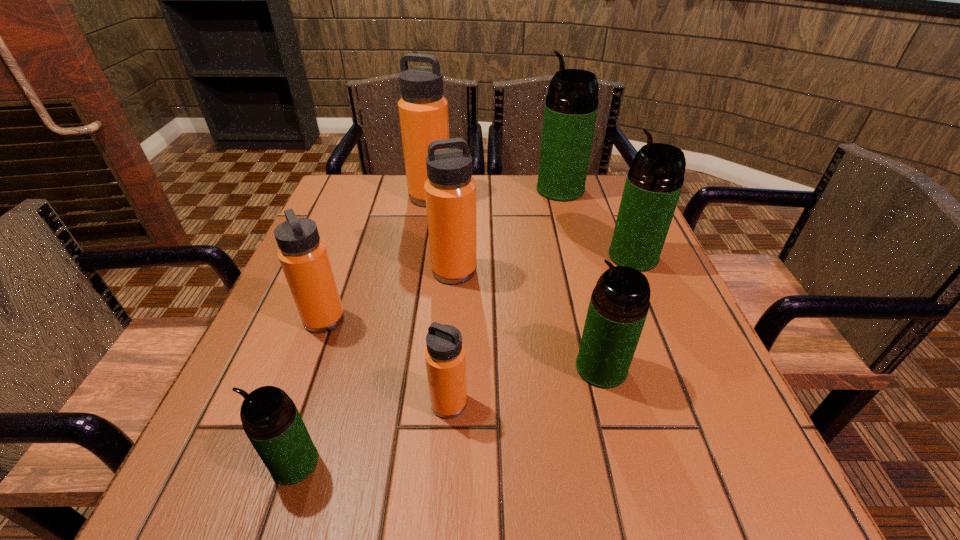
This screenshot has height=540, width=960. I want to click on vacant area situated 0.200m from the spout of the second nearest green thermos bottle, so click(x=462, y=368).

The image size is (960, 540). I want to click on vacant space situated 0.150m from the spout of the second nearest green thermos bottle, so click(x=490, y=368).

Identify the location of free space located from the spout of the second nearest green thermos bottle. This screenshot has height=540, width=960. (507, 368).

Identify the location of free space located 0.070m from the spout of the nearest object. (224, 463).

Find the location of a particular element. vacant space positioned 0.100m from the spout of the nearest object is located at coordinates (203, 463).

Identify the location of vacant space located on the back of the smallest orange thermos bottle. (455, 298).

The width and height of the screenshot is (960, 540). What are the coordinates of `object present at the near edge` in the screenshot? It's located at (270, 419).

You are a GUI agent. You are given a task and a screenshot of the screen. Output one action in this format:
    pyautogui.click(x=<x>, y=<y>)
    Task: Click on the object situated at the near left corner
    
    Given the screenshot: What is the action you would take?
    pyautogui.click(x=270, y=419)

The image size is (960, 540). Find the location of `object present at the far right corner`. object present at the far right corner is located at coordinates (571, 106).

I want to click on free space at the far edge, so (x=404, y=186).